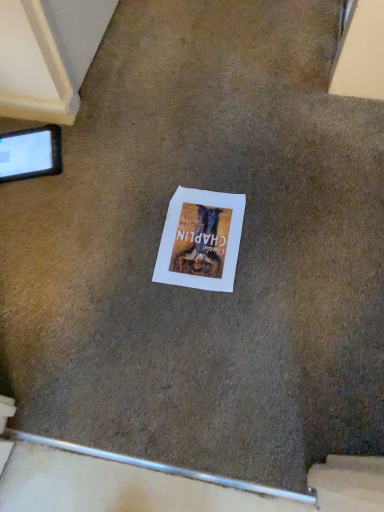
The height and width of the screenshot is (512, 384). I want to click on free space in front of black glossy tablet at upper left, so click(x=29, y=216).